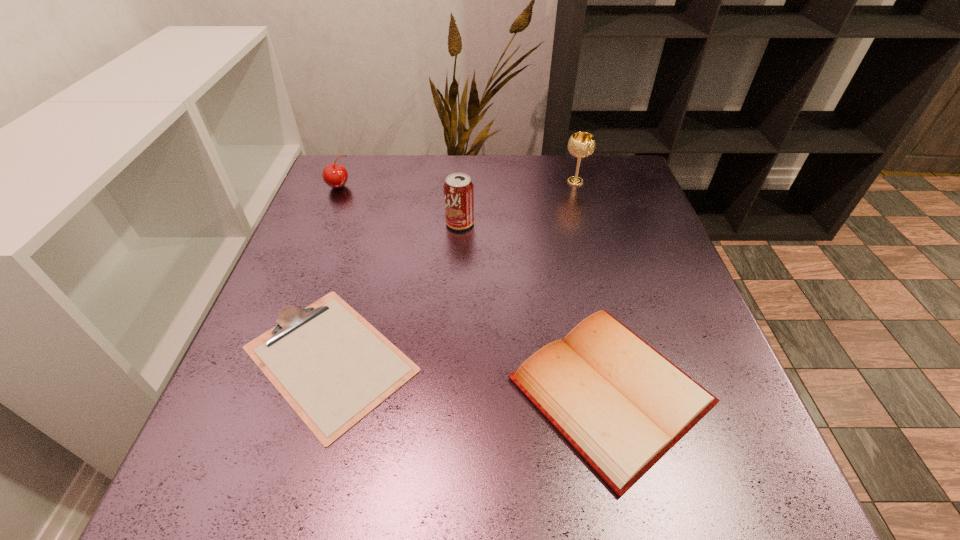
Find the location of a particular element. Image resolution: width=960 pixels, height=540 pixels. object that is at the near right corner is located at coordinates (622, 405).

Find the location of `vacant space at the far edge of the desktop`. vacant space at the far edge of the desktop is located at coordinates (446, 162).

In order to click on vacant position at the near edge of the desktop in this screenshot , I will do `click(509, 481)`.

Where is `vacant point at the left edge`? The height and width of the screenshot is (540, 960). vacant point at the left edge is located at coordinates (343, 224).

This screenshot has width=960, height=540. I want to click on vacant space at the right edge of the desktop, so click(x=673, y=253).

You are a GUI agent. You are given a task and a screenshot of the screen. Output one action in this format:
    pyautogui.click(x=<x>, y=<y>)
    Task: Click on the vacant space at the far left corner of the desktop
    
    Given the screenshot: What is the action you would take?
    pyautogui.click(x=342, y=190)

In the image, there is a desktop. Find the location of `free space at the far right corner`. free space at the far right corner is located at coordinates (618, 184).

Identify the location of vacant region at the near right corner of the desktop. (739, 481).

What are the coordinates of `vacant point located between the third shortest object and the Bible` in the screenshot? It's located at (474, 288).

Locate an element on the screen. The image size is (960, 540). free spot between the Bible and the chalice is located at coordinates (593, 286).